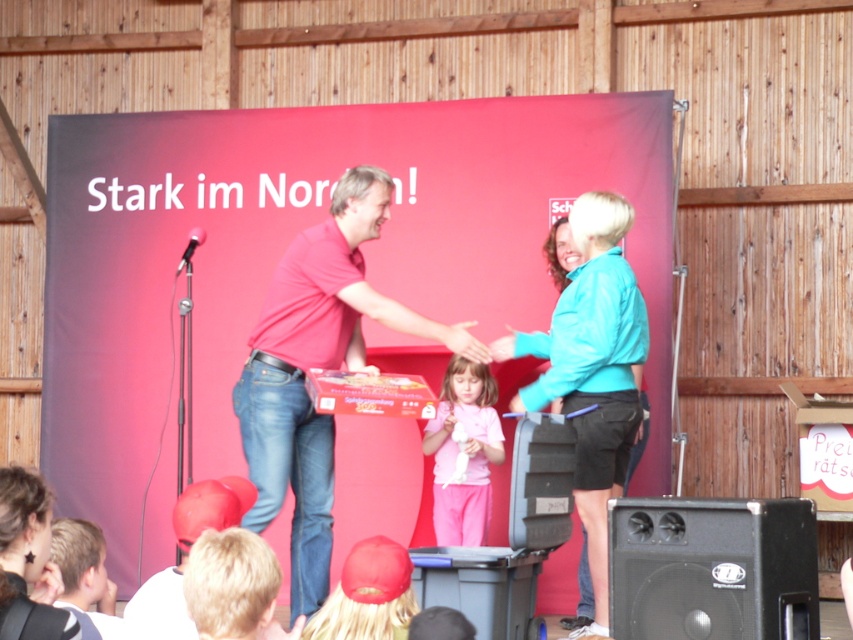
Question: Estimate the real-world distances between objects in this image. Which object is farther from the matte red shirt at center?

Choices:
 (A) matte red cap at lower left
 (B) black plastic microphone at center
 (C) black textured speaker at lower center
 (D) black plastic speaker at lower right

Answer: (D)

Question: Is matte red shirt at center thinner than black plastic speaker at lower right?

Choices:
 (A) yes
 (B) no

Answer: (B)

Question: Can you confirm if pink cotton shirt at center is positioned to the right of matte red cap at lower left?

Choices:
 (A) yes
 (B) no

Answer: (A)

Question: Which of these objects is positioned closest to the turquoise fabric jacket at center?

Choices:
 (A) black plastic speaker at lower right
 (B) matte red cap at lower left
 (C) pink cotton shirt at center

Answer: (C)

Question: Is pink cotton shirt at center further to the viewer compared to black plastic microphone at center?

Choices:
 (A) no
 (B) yes

Answer: (B)

Question: Based on their relative distances, which object is farther from the matte red cap at lower left?

Choices:
 (A) black plastic speaker at lower right
 (B) matte red shirt at center
 (C) pink cotton shirt at center

Answer: (C)